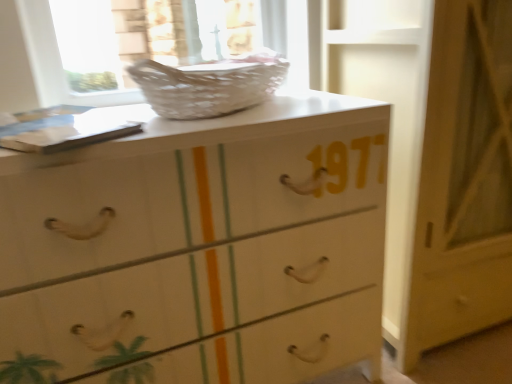
Question: Is white wicker basket at upper center to the left or to the right of white glossy door at center in the image?

Choices:
 (A) left
 (B) right

Answer: (A)

Question: From their relative heights in the image, would you say white wicker basket at upper center is taller or shorter than white glossy door at center?

Choices:
 (A) tall
 (B) short

Answer: (B)

Question: Which object is positioned farthest from the white glossy chest of drawers at center?

Choices:
 (A) white glossy door at center
 (B) white wicker basket at upper center

Answer: (A)

Question: Which is farther from the white glossy door at center?

Choices:
 (A) white wicker basket at upper center
 (B) white glossy chest of drawers at center

Answer: (A)